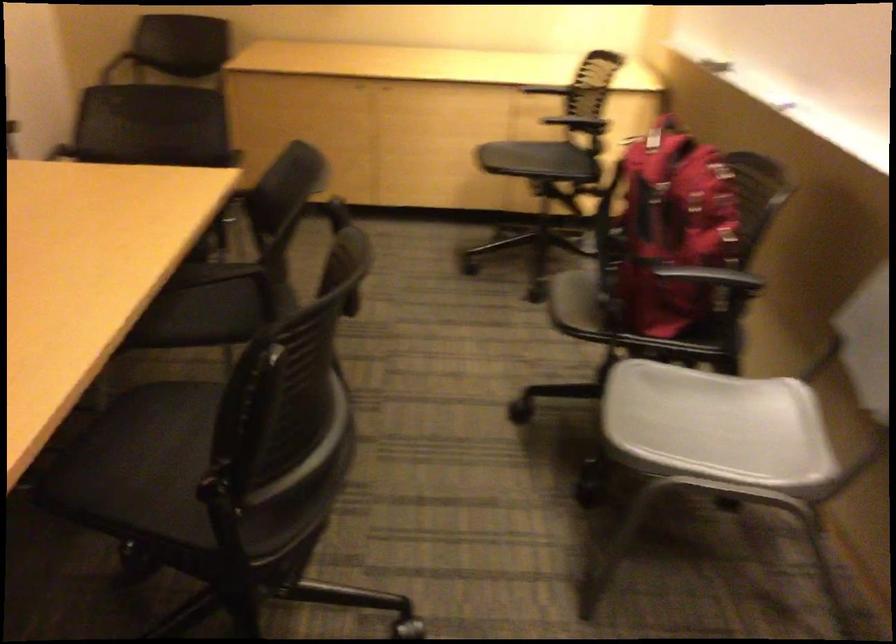
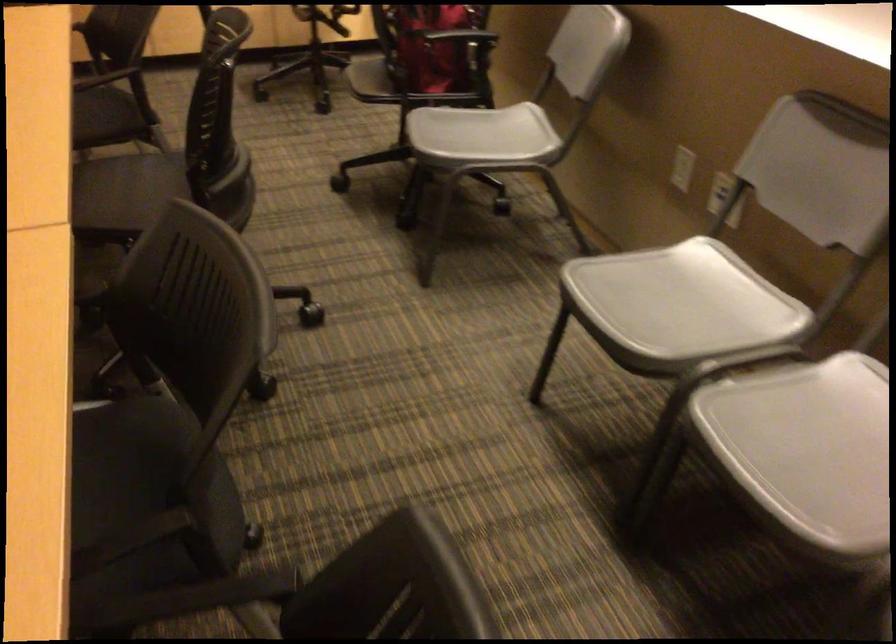
Find the pixel in the second image that matches (716,424) in the first image.

(481, 136)